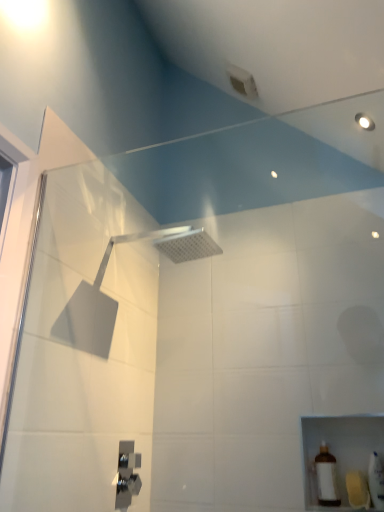
Question: Relative to silver metallic shower head at upper center, arranged as the 2th shower when viewed from the left, is white glossy bottle at lower right, the second toiletry when ordered from left to right, in front or behind?

Choices:
 (A) front
 (B) behind

Answer: (B)

Question: Considering the positions of white glossy bottle at lower right, acting as the first toiletry starting from the right, and silver metallic shower head at upper center, arranged as the 2th shower when viewed from the left, in the image, is white glossy bottle at lower right, acting as the first toiletry starting from the right, taller or shorter than silver metallic shower head at upper center, arranged as the 2th shower when viewed from the left,?

Choices:
 (A) tall
 (B) short

Answer: (A)

Question: Which object is positioned closest to the white glossy bottle at lower right, the second toiletry when ordered from left to right?

Choices:
 (A) brown matte bottle at lower right, marked as the second toiletry in a right-to-left arrangement
 (B) satin nickel faucet at lower center, acting as the first shower starting from the bottom
 (C) silver metallic shower head at upper center, the first shower from the top

Answer: (A)

Question: Estimate the real-world distances between objects in this image. Which object is closer to the satin nickel faucet at lower center, placed as the second shower when sorted from top to bottom?

Choices:
 (A) white glossy bottle at lower right, the second toiletry when ordered from left to right
 (B) brown matte bottle at lower right, marked as the second toiletry in a right-to-left arrangement
 (C) silver metallic shower head at upper center, which is the first shower from right to left

Answer: (B)